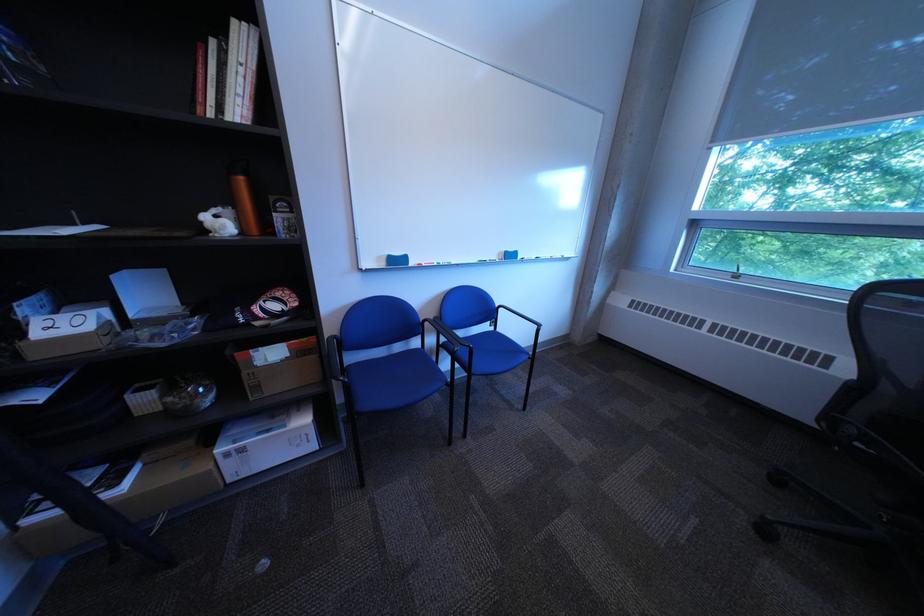
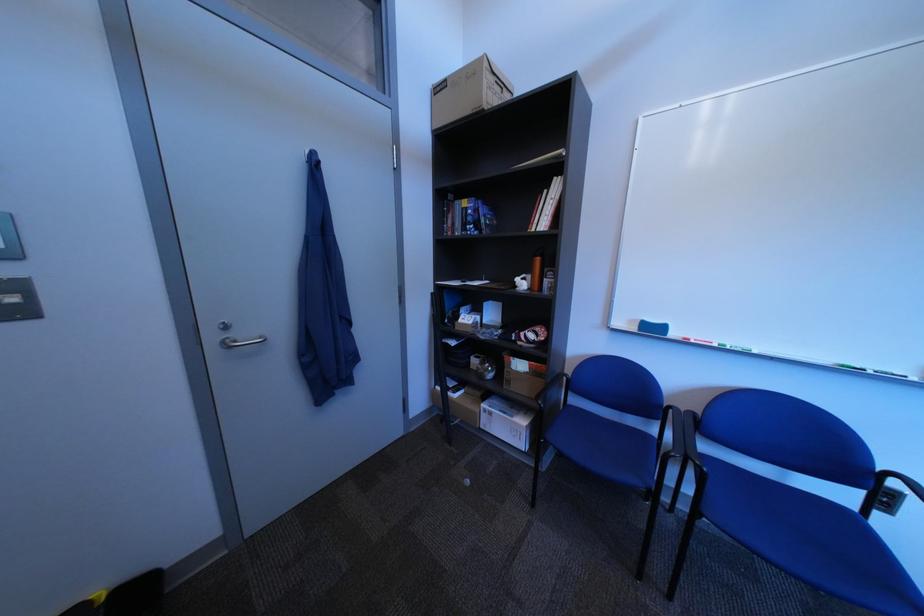
Where in the second image is the point corresponding to point (160, 467) from the first image?

(480, 394)